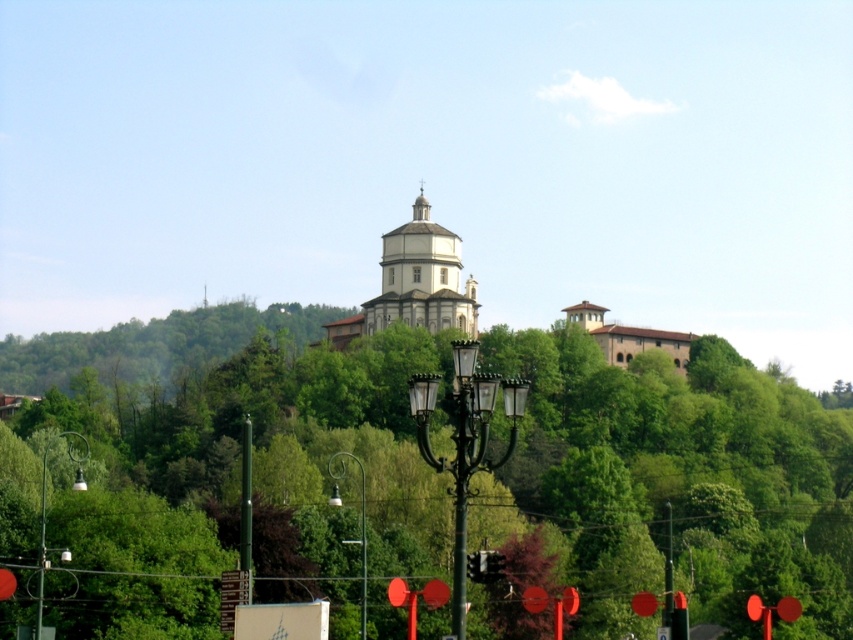
Does point (397, 307) come in front of point (631, 330)?

Yes, point (397, 307) is closer to viewer.

Does white smooth church at center appear on the right side of brown stone building at upper right?

No, white smooth church at center is not to the right of brown stone building at upper right.

Between point (438, 241) and point (598, 332), which one is positioned in front?

Positioned in front is point (438, 241).

Locate an element on the screen. The height and width of the screenshot is (640, 853). white smooth church at center is located at coordinates (421, 278).

What do you see at coordinates (628, 337) in the screenshot? I see `brown stone building at upper right` at bounding box center [628, 337].

Does point (677, 346) come in front of point (328, 500)?

That is False.

Locate an element on the screen. brown stone building at upper right is located at coordinates (628, 337).

Who is taller, white smooth church at center or metallic glass lamp post at center?

With more height is white smooth church at center.

Who is more distant from viewer, [415,296] or [328,502]?

Point [415,296]

Find the location of a particular element. The height and width of the screenshot is (640, 853). white smooth church at center is located at coordinates (421, 278).

Find the location of a particular element. white smooth church at center is located at coordinates (421, 278).